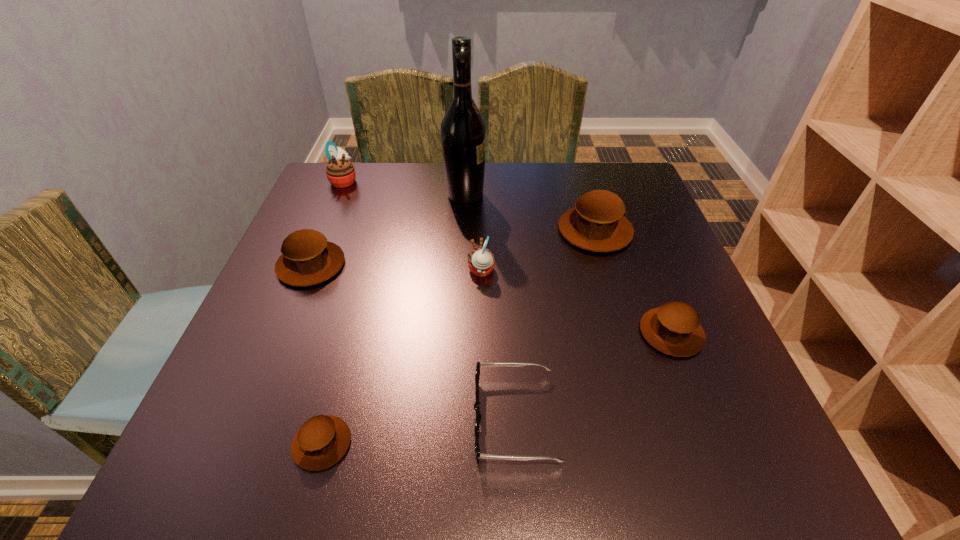
Locate an element on the screen. The height and width of the screenshot is (540, 960). vacant space located 0.170m on the front of the third biggest brown muffin is located at coordinates (717, 449).

Identify the location of free region located 0.070m on the left of the smallest brown muffin. The height and width of the screenshot is (540, 960). (249, 443).

Where is `vacant space positioned 0.280m on the front-facing side of the black spectacles`? The height and width of the screenshot is (540, 960). vacant space positioned 0.280m on the front-facing side of the black spectacles is located at coordinates (302, 418).

Image resolution: width=960 pixels, height=540 pixels. I want to click on blank space located on the front-facing side of the black spectacles, so point(406,418).

Where is `blank space located on the front-facing side of the black spectacles`? This screenshot has width=960, height=540. blank space located on the front-facing side of the black spectacles is located at coordinates (339, 418).

Image resolution: width=960 pixels, height=540 pixels. Find the location of `wine bottle present at the far edge`. wine bottle present at the far edge is located at coordinates (463, 129).

I want to click on muffin that is at the near edge, so click(323, 440).

Find the location of `spectacles present at the near edge`. spectacles present at the near edge is located at coordinates (477, 374).

The height and width of the screenshot is (540, 960). In order to click on object present at the far left corner in this screenshot , I will do `click(340, 172)`.

This screenshot has height=540, width=960. What are the coordinates of `object located at the near left corner` in the screenshot? It's located at (323, 440).